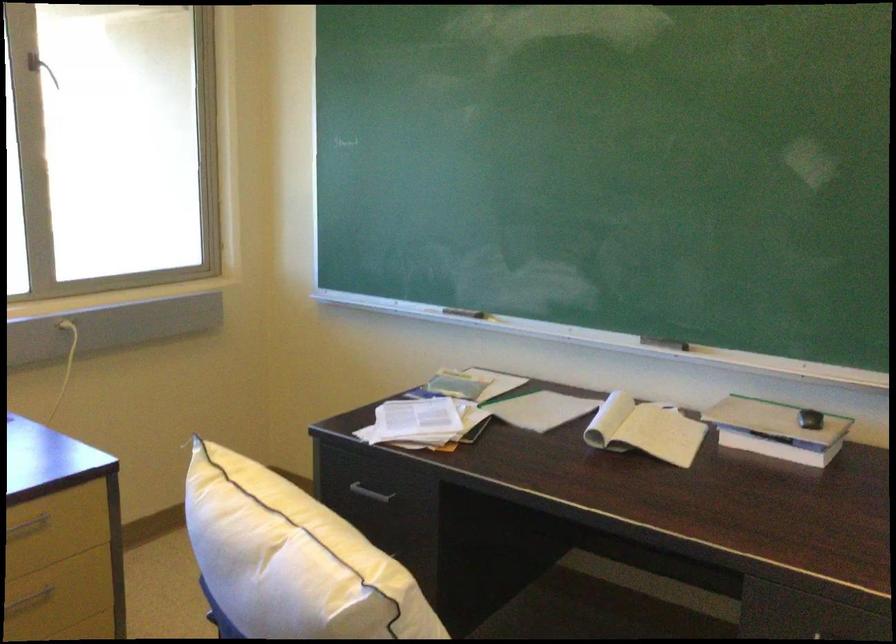
Find where to turn the window crank handle. Please return your answer as a coordinate pair (x, y).

(40, 68)